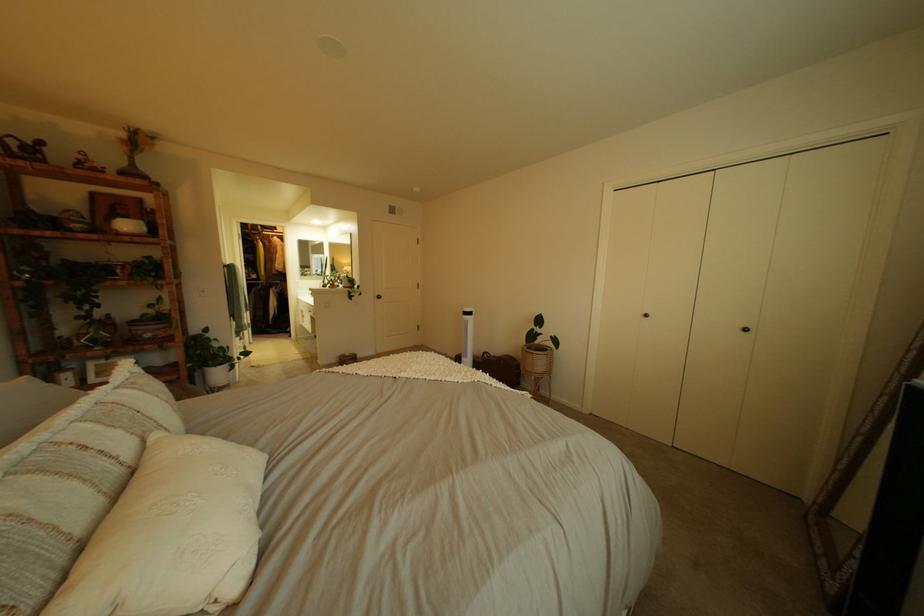
Describe the element at coordinates (651, 315) in the screenshot. I see `the black door handle` at that location.